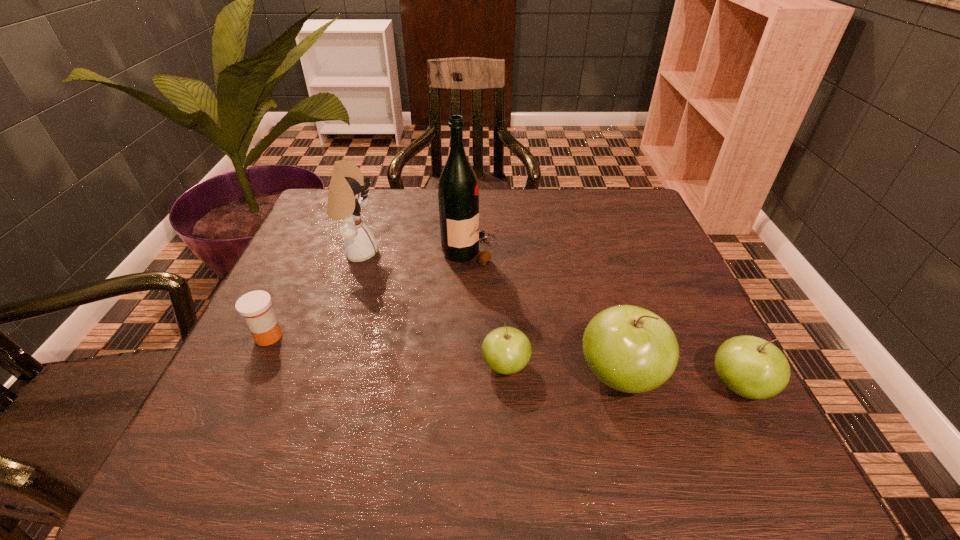
Find the location of a particular element. Image resolution: width=960 pixels, height=540 pixels. vacant space located 0.290m on the left of the third tallest object is located at coordinates (418, 376).

Find the location of a particular element. vacant space situated on the left of the rightmost apple is located at coordinates (551, 387).

Identify the location of free space located on the surface of the wine bottle. point(658,251).

At what (x,y) coordinates should I click in order to perform the action: click on free space located 0.110m at the front face of the fifth object from right to left. Please return your answer as a coordinate pair (x, y). This screenshot has width=960, height=540. Looking at the image, I should click on pos(423,253).

Where is `vacant space situated on the label of the medicine`? Image resolution: width=960 pixels, height=540 pixels. vacant space situated on the label of the medicine is located at coordinates click(x=415, y=336).

Locate an element on the screen. The image size is (960, 540). wine bottle located at the far edge is located at coordinates (458, 195).

Find the location of a particular element. This screenshot has height=540, width=960. doll situated at the far edge is located at coordinates point(347,195).

Find the location of a particular element. This screenshot has width=960, height=540. doll that is at the left edge is located at coordinates (347, 195).

Locate an element on the screen. medicine that is positioned at the left edge is located at coordinates (255, 307).

Locate an element on the screen. Image resolution: width=960 pixels, height=540 pixels. object present at the far left corner is located at coordinates (347, 195).